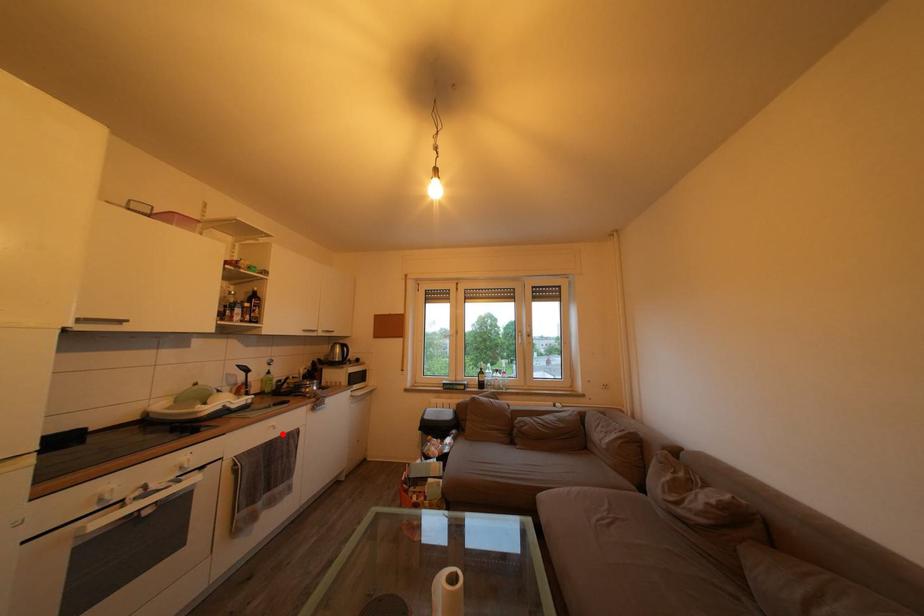
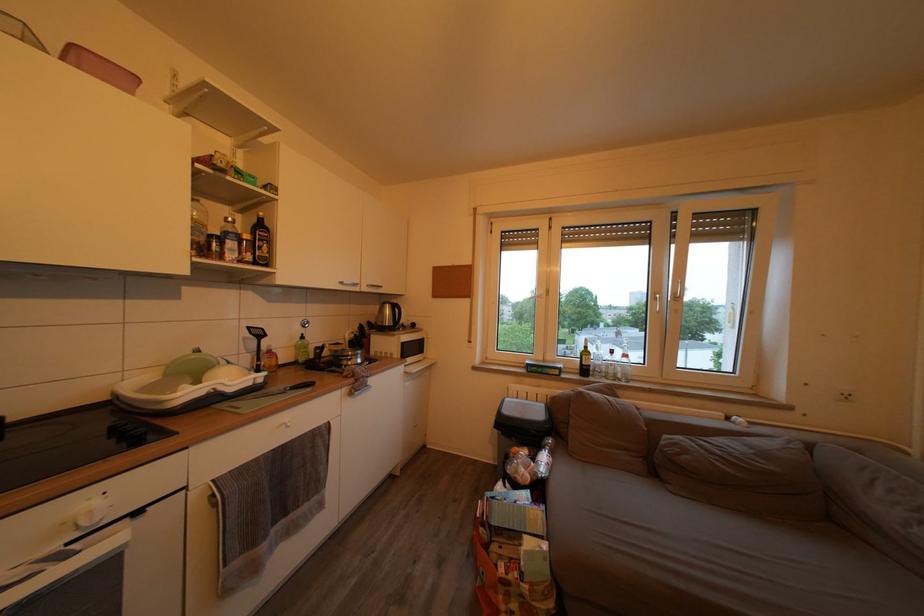
Question: A red point is marked in image1. In image2, is the corresponding 3D point closer to the camera or farther? Reply with the corresponding letter.

Choices:
 (A) The corresponding 3D point is closer.
 (B) The corresponding 3D point is farther.

Answer: (A)